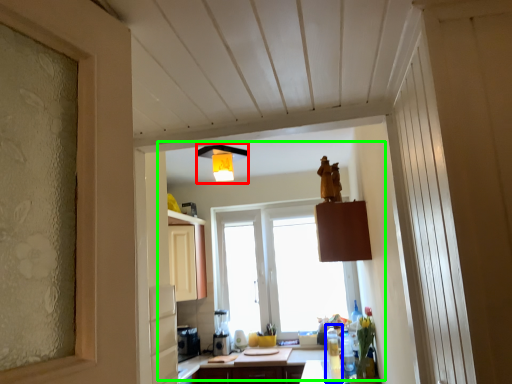
Question: Based on their relative distances, which object is nearer to light fixture (highlighted by a red box)? Choose from bottle (highlighted by a blue box) and bay window (highlighted by a green box).

Choices:
 (A) bottle
 (B) bay window

Answer: (B)